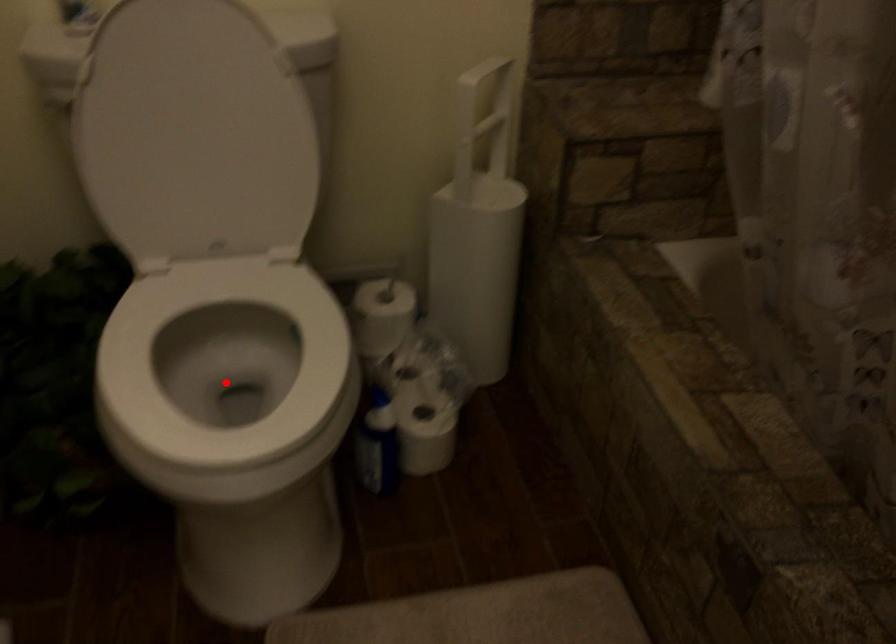
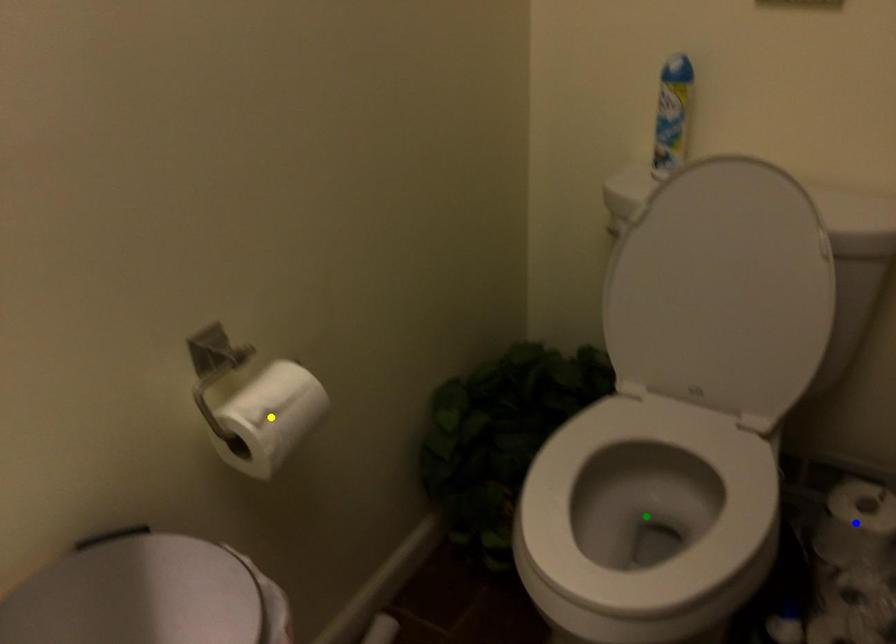
Question: I am providing you with two images of the same scene from different viewpoints. A red point is marked on the first image. You are given multiple points on the second image. In image 2, which mark is for the same physical point as the one in image 1?

Choices:
 (A) blue point
 (B) yellow point
 (C) green point

Answer: (C)